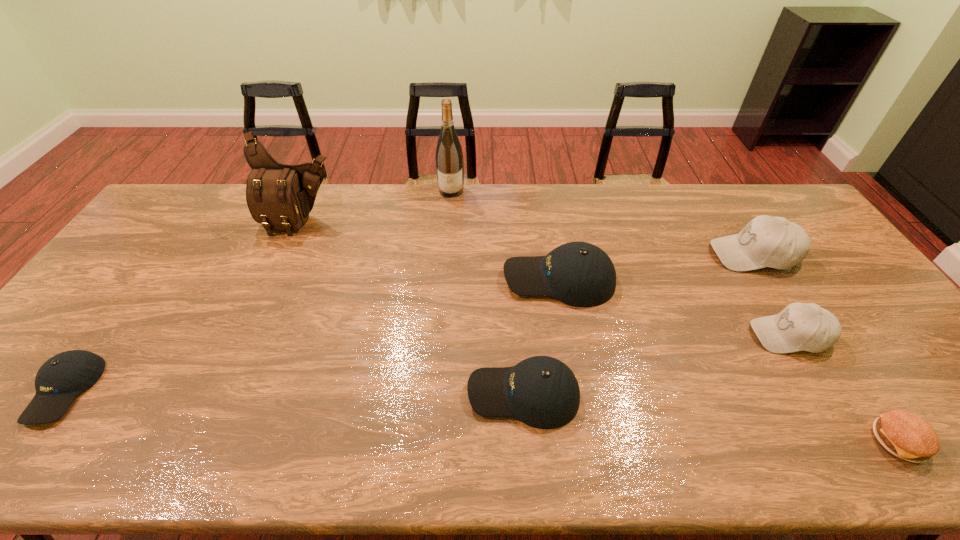
Where is `blue baseball cap that is the closest to the second biggest blue baseball cap`? The image size is (960, 540). blue baseball cap that is the closest to the second biggest blue baseball cap is located at coordinates (580, 274).

Find the location of a particular element. This screenshot has height=540, width=960. the third closest blue baseball cap to the brown shoulder bag is located at coordinates (542, 392).

Where is `vacant space that satisfies the following two spatial constraints: 1. on the back side of the hamburger; 2. on the front-facing side of the second smallest blue baseball cap`? The image size is (960, 540). vacant space that satisfies the following two spatial constraints: 1. on the back side of the hamburger; 2. on the front-facing side of the second smallest blue baseball cap is located at coordinates (867, 394).

Image resolution: width=960 pixels, height=540 pixels. In order to click on free spot that satisfies the following two spatial constraints: 1. on the front-facing side of the leftmost baseball cap; 2. on the right side of the hamburger in this screenshot , I will do `click(27, 441)`.

What are the coordinates of `vacant space that satisfies the following two spatial constraints: 1. on the front-facing side of the farther gray baseball cap; 2. on the front-facing side of the leftmost object` in the screenshot? It's located at (838, 390).

Find the location of a particular element. The width and height of the screenshot is (960, 540). free point that satisfies the following two spatial constraints: 1. on the front-facing side of the seventh shortest object; 2. on the right side of the hamburger is located at coordinates (204, 441).

Locate an element on the screen. vacant space that satisfies the following two spatial constraints: 1. on the front-facing side of the smaller gray baseball cap; 2. on the front-facing side of the leftmost blue baseball cap is located at coordinates click(822, 390).

Image resolution: width=960 pixels, height=540 pixels. What are the coordinates of `vacant point that satisfies the following two spatial constraints: 1. on the front-facing side of the leftmost baseball cap; 2. on the right side of the hamburger` in the screenshot? It's located at (27, 441).